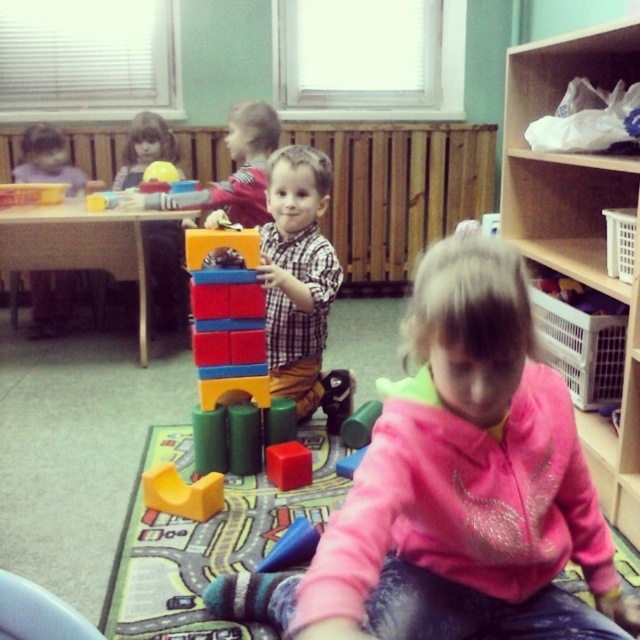
In the scene shown: You are a teacher in the classroom and want to place a new poster on the wall above the rubber block at center. Is the wooden bookshelf at upper right in a suitable position to hang the poster?

The wooden bookshelf at upper right is above the rubber block at center, so it is in a suitable position to hang the poster above the rubber block at center.

Looking at this image, you are a teacher in the classroom and need to place a new toy between the checkered fabric shirt at center and the rubber block at center. Where should you place it?

The checkered fabric shirt at center is positioned on the right side of the rubber block at center, so placing the new toy between them would require placing it to the left of the checkered fabric shirt at center and to the right of the rubber block at center.

Based on the scene description, where exactly are the multicolored plastic blocks at center located in terms of their 2D coordinates?

The multicolored plastic blocks at center are located at the 2D coordinates of point (227, 364).